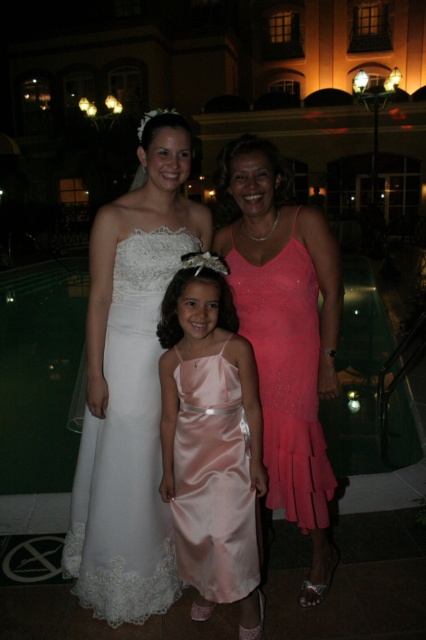
You are a photographer at this event and need to capture a group photo of the satin dress at center and the shiny pink dress at center. The camera frame can only accommodate one of them fully. Which dress should you focus on to ensure it fits within the frame?

The satin dress at center is larger in size than the shiny pink dress at center, so focusing on the satin dress at center will ensure it fits within the frame.

You are a photographer at the event and want to position yourself to capture the white satin dress at center in the best possible lighting. Based on the scene description, where should you stand relative to the dress to ensure the pool reflections enhance the photo?

To capture the white satin dress at center with enhanced lighting from the pool reflections, position yourself so the dress is centered in your frame, aligned with the pool area. The pool reflects the surrounding lights, so positioning yourself at an angle where the dress is illuminated by these reflections would work best.